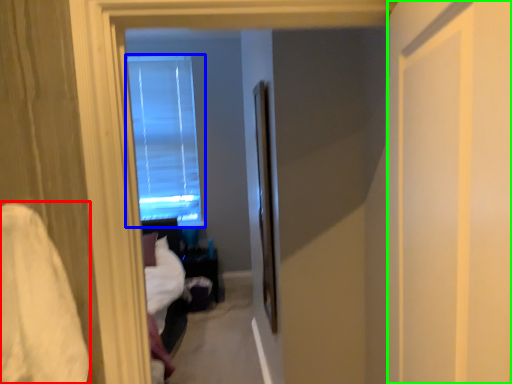
Question: Estimate the real-world distances between objects in this image. Which object is farther from sheet (highlighted by a red box), window (highlighted by a blue box) or screen door (highlighted by a green box)?

Choices:
 (A) window
 (B) screen door

Answer: (A)